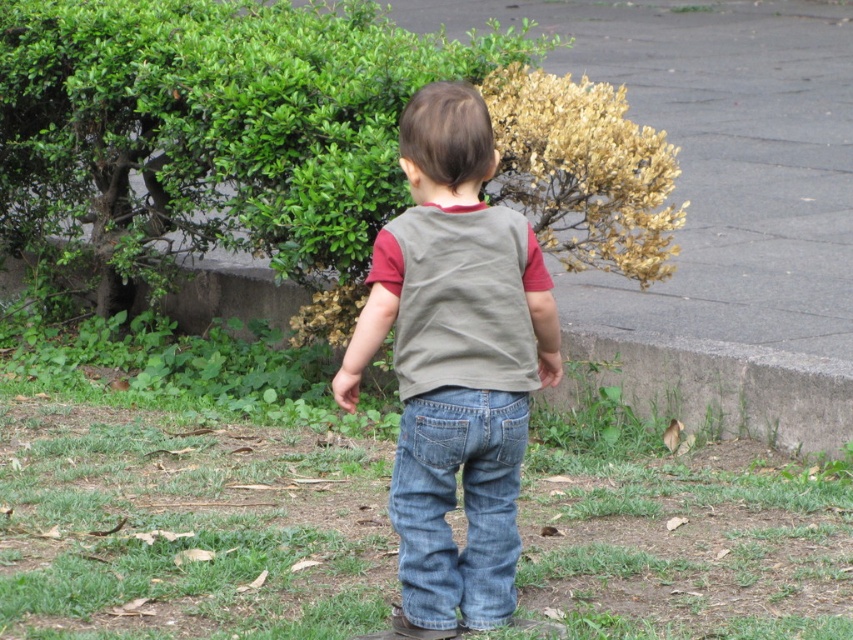
Which is above, green grass at lower center or denim jeans at lower center?

green grass at lower center is higher up.

Which of these two, green grass at lower center or denim jeans at lower center, stands taller?

green grass at lower center

The height and width of the screenshot is (640, 853). I want to click on green grass at lower center, so click(183, 493).

The width and height of the screenshot is (853, 640). I want to click on green grass at lower center, so click(x=183, y=493).

Can you confirm if green grass at lower center is shorter than green leafy bush at upper center?

Yes.

Who is more forward, (149,596) or (241,148)?

Point (149,596) is in front.

Find the location of a particular element. Image resolution: width=853 pixels, height=640 pixels. green grass at lower center is located at coordinates (183, 493).

Can you confirm if green leafy bush at upper center is taller than denim jeans at center?

Indeed, green leafy bush at upper center has a greater height compared to denim jeans at center.

Image resolution: width=853 pixels, height=640 pixels. I want to click on green leafy bush at upper center, so click(213, 129).